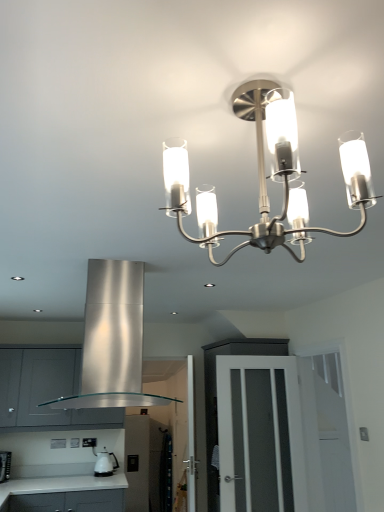
Question: From the image's perspective, is clear glass door at center positioned above or below stainless steel exhaust hood at center?

Choices:
 (A) above
 (B) below

Answer: (B)

Question: Visually, is clear glass door at center positioned to the left or to the right of stainless steel exhaust hood at center?

Choices:
 (A) left
 (B) right

Answer: (B)

Question: Based on their relative distances, which object is farther from the white glossy kettle at lower left?

Choices:
 (A) clear glass door at center
 (B) stainless steel exhaust hood at center
 (C) satin nickel chandelier at upper center
 (D) satin silver cabinet at lower left
 (E) white laminate countertop at lower left

Answer: (C)

Question: Which of these objects is positioned farthest from the stainless steel exhaust hood at center?

Choices:
 (A) white glossy kettle at lower left
 (B) satin nickel chandelier at upper center
 (C) clear glass door at center
 (D) white laminate countertop at lower left
 (E) satin silver cabinet at lower left

Answer: (A)